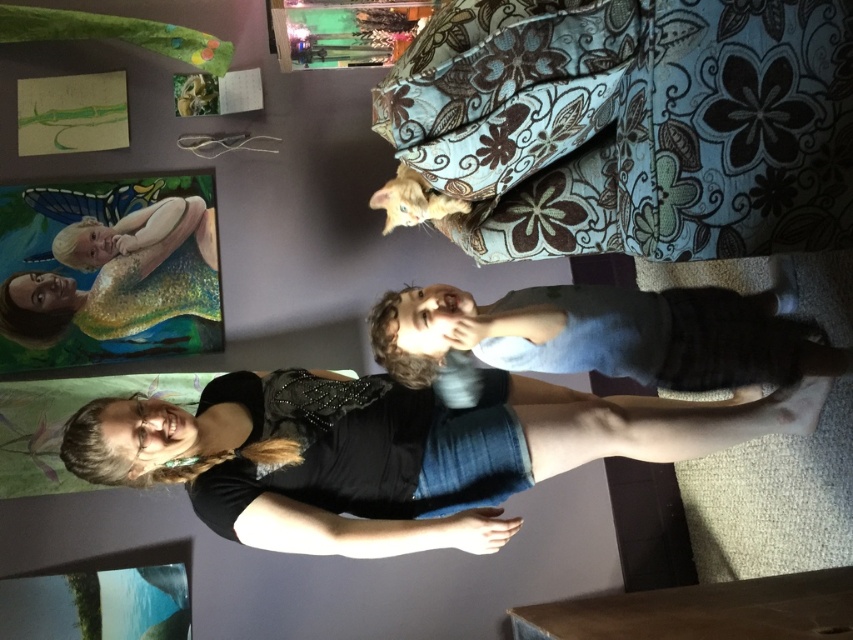
In the image, there is a woman wearing black denim shorts at lower center and a child wearing sleeveless blue top and dark shorts. Where is the point located at coordinates (302, 476) in relation to the black denim shorts at lower center?

The point located at coordinates (302, 476) is on the black denim shorts at lower center.

You are a photographer setting up for a family portrait. You notice the light blue fabric at center and the matte black shirt at lower left in the scene. Which object should you adjust to ensure both are in focus? Explain your reasoning.

The light blue fabric at center is closer to the viewer than the matte black shirt at lower left. To ensure both are in focus, adjust the camera focus to a point between them so that the depth of field captures both the closer fabric and the farther shirt.

You are a fashion designer observing the image. You need to determine which item is shorter in length between the black denim shorts at lower center and the matte black shirt at lower left. Which one is shorter?

The black denim shorts at lower center is shorter than the matte black shirt at lower left.